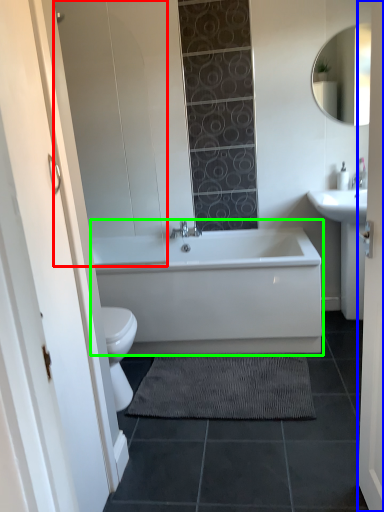
Question: Based on their relative distances, which object is farther from glass door (highlighted by a red box)? Choose from door (highlighted by a blue box) and bathtub (highlighted by a green box).

Choices:
 (A) door
 (B) bathtub

Answer: (A)